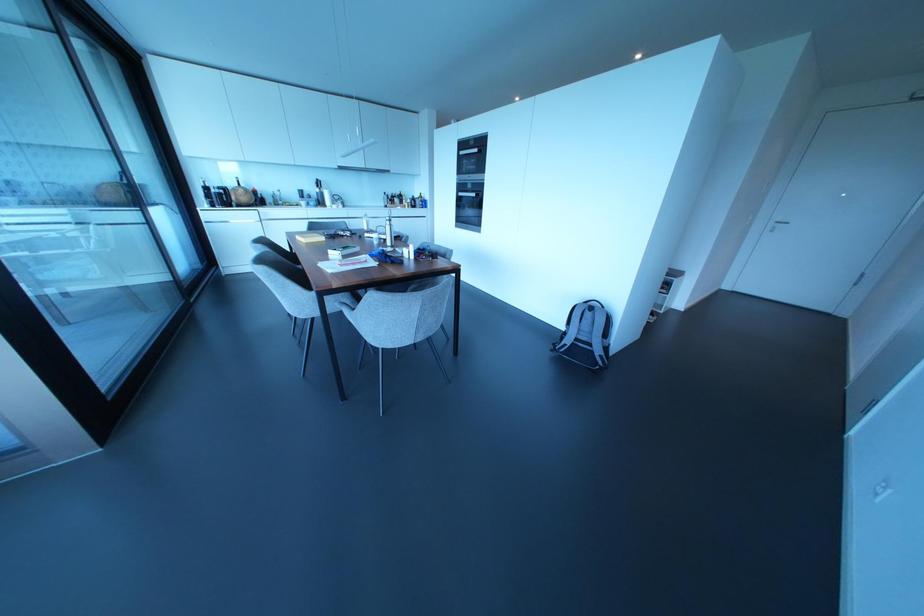
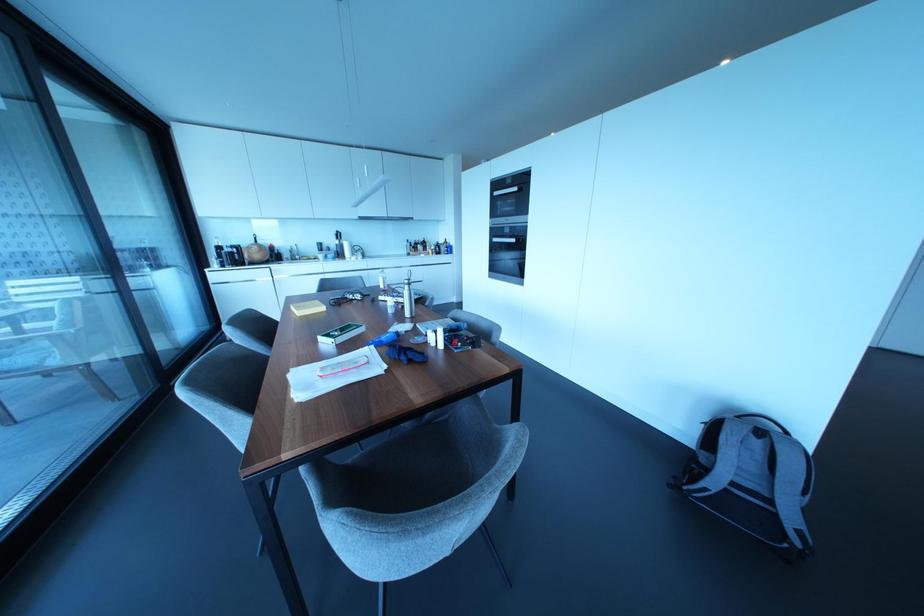
Question: Based on the continuous images, in which direction is the camera rotating? Reply with the corresponding letter.

Choices:
 (A) Left
 (B) Right
 (C) Up
 (D) Down

Answer: (C)